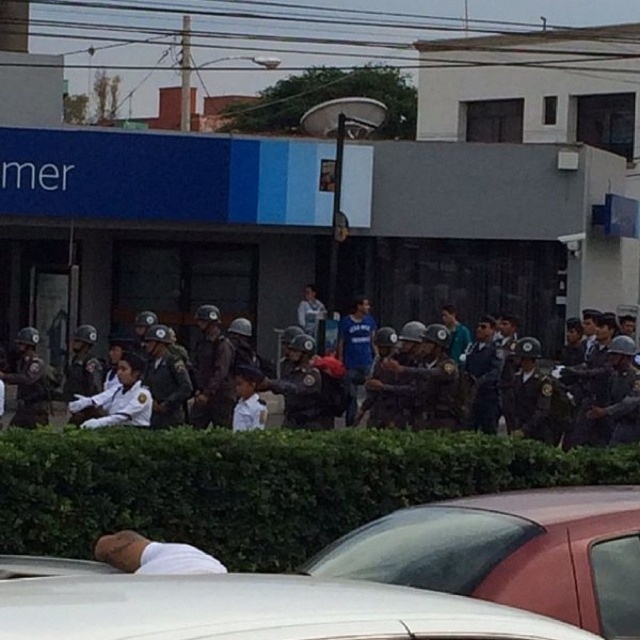
From the picture: You are a delivery driver who needs to park your white matte car at lower center in a specific spot. The parking spot is located at coordinates point 0.909, 0.584. Can you confirm if your car is already parked correctly?

Yes, the white matte car at lower center is already parked correctly at the coordinates point (372, 580) as specified.

You are a pedestrian standing at the point marked by the coordinates point (372, 580). You want to cross the street to reach the building with the blue and white facade. Is there a clear path to the building without passing through the group of police officers or the civilians behind them?

The point (372, 580) marks white matte car at lower center. Since the car is at the lower center, it is likely positioned between the pedestrians and the building, creating an obstruction. Therefore, you would need to go around the car to reach the building without passing through the groups of officers or civilians.

You are a pedestrian trying to cross the street where the white matte car at lower center and the matte black helmets at center are located. Which object is closer to the ground?

The white matte car at lower center is closer to the ground because it is positioned below the matte black helmets at center.